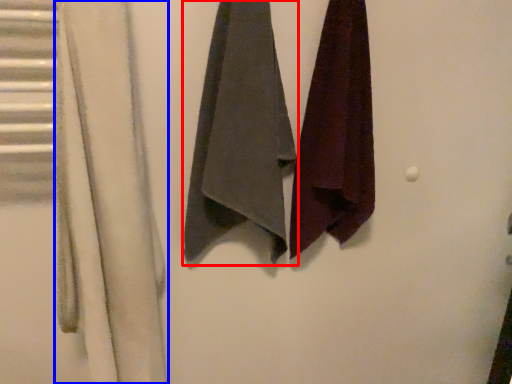
Question: Among these objects, which one is nearest to the camera, towel (highlighted by a red box) or curtain (highlighted by a blue box)?

Choices:
 (A) towel
 (B) curtain

Answer: (B)